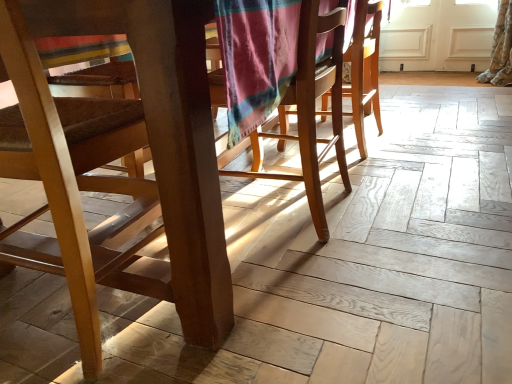
What do you see at coordinates (119, 157) in the screenshot?
I see `wooden chair at left, which is the 2th chair in right-to-left order` at bounding box center [119, 157].

Measure the distance between wooden chair at left, marked as the 1th chair in a left-to-right arrangement, and camera.

wooden chair at left, marked as the 1th chair in a left-to-right arrangement, is 22.46 inches away from camera.

What is the approximate width of wooden chair at left, which is the 2th chair in right-to-left order?

wooden chair at left, which is the 2th chair in right-to-left order, is 18.88 inches wide.

Where is `wooden chair at left, which is the 2th chair in right-to-left order`? wooden chair at left, which is the 2th chair in right-to-left order is located at coordinates (119, 157).

The image size is (512, 384). What are the coordinates of `wooden chair at center, the 2th chair in the left-to-right sequence` in the screenshot? It's located at (313, 108).

What do you see at coordinates (313, 108) in the screenshot? Image resolution: width=512 pixels, height=384 pixels. I see `wooden chair at center, the 2th chair in the left-to-right sequence` at bounding box center [313, 108].

In order to face wooden chair at center, which is the 1th chair from right to left, should I rotate leftwards or rightwards?

You should rotate right by 8.729 degrees.

Find the location of a particular element. The height and width of the screenshot is (384, 512). wooden chair at left, marked as the 1th chair in a left-to-right arrangement is located at coordinates (119, 157).

Can you confirm if wooden chair at center, which is the 1th chair from right to left, is positioned to the right of wooden chair at left, marked as the 1th chair in a left-to-right arrangement?

Yes, wooden chair at center, which is the 1th chair from right to left, is to the right of wooden chair at left, marked as the 1th chair in a left-to-right arrangement.

Is the position of wooden chair at center, which is the 1th chair from right to left, less distant than that of wooden chair at left, marked as the 1th chair in a left-to-right arrangement?

No, the depth of wooden chair at center, which is the 1th chair from right to left, is greater than that of wooden chair at left, marked as the 1th chair in a left-to-right arrangement.

Which is further, (307, 72) or (191, 246)?

Point (307, 72)

From the image's perspective, would you say wooden chair at center, which is the 1th chair from right to left, is shown under wooden chair at left, which is the 2th chair in right-to-left order?

No, from the image's perspective, wooden chair at center, which is the 1th chair from right to left, is not below wooden chair at left, which is the 2th chair in right-to-left order.

From a real-world perspective, which is physically above, wooden chair at center, the 2th chair in the left-to-right sequence, or wooden chair at left, marked as the 1th chair in a left-to-right arrangement?

wooden chair at left, marked as the 1th chair in a left-to-right arrangement, is physically above.

Which of these two, wooden chair at center, which is the 1th chair from right to left, or wooden chair at left, marked as the 1th chair in a left-to-right arrangement, is wider?

wooden chair at left, marked as the 1th chair in a left-to-right arrangement.

Considering the relative sizes of wooden chair at center, the 2th chair in the left-to-right sequence, and wooden chair at left, which is the 2th chair in right-to-left order, in the image provided, is wooden chair at center, the 2th chair in the left-to-right sequence, shorter than wooden chair at left, which is the 2th chair in right-to-left order,?

Yes, wooden chair at center, the 2th chair in the left-to-right sequence, is shorter than wooden chair at left, which is the 2th chair in right-to-left order.

In terms of size, does wooden chair at center, which is the 1th chair from right to left, appear bigger or smaller than wooden chair at left, which is the 2th chair in right-to-left order?

wooden chair at center, which is the 1th chair from right to left, is smaller than wooden chair at left, which is the 2th chair in right-to-left order.

Is wooden chair at center, which is the 1th chair from right to left, spatially inside wooden chair at left, marked as the 1th chair in a left-to-right arrangement, or outside of it?

wooden chair at center, which is the 1th chair from right to left, exists outside the volume of wooden chair at left, marked as the 1th chair in a left-to-right arrangement.

Is wooden chair at center, the 2th chair in the left-to-right sequence, far away from wooden chair at left, which is the 2th chair in right-to-left order?

That's not correct — wooden chair at center, the 2th chair in the left-to-right sequence, is a little close to wooden chair at left, which is the 2th chair in right-to-left order.

Is wooden chair at center, which is the 1th chair from right to left, oriented towards wooden chair at left, marked as the 1th chair in a left-to-right arrangement?

No, wooden chair at center, which is the 1th chair from right to left, is not aimed at wooden chair at left, marked as the 1th chair in a left-to-right arrangement.

Can you tell me how much wooden chair at center, the 2th chair in the left-to-right sequence, and wooden chair at left, which is the 2th chair in right-to-left order, differ in facing direction?

wooden chair at center, the 2th chair in the left-to-right sequence, and wooden chair at left, which is the 2th chair in right-to-left order, are facing 90 degrees away from each other.

In the image, there is a wooden chair at center, which is the 1th chair from right to left. What are the coordinates of `chair below it (from the image's perspective)` in the screenshot? It's located at point(119,157).

Can you confirm if wooden chair at left, marked as the 1th chair in a left-to-right arrangement, is positioned to the right of wooden chair at center, the 2th chair in the left-to-right sequence?

Incorrect, wooden chair at left, marked as the 1th chair in a left-to-right arrangement, is not on the right side of wooden chair at center, the 2th chair in the left-to-right sequence.

Between wooden chair at left, marked as the 1th chair in a left-to-right arrangement, and wooden chair at center, which is the 1th chair from right to left, which one is positioned in front?

wooden chair at left, marked as the 1th chair in a left-to-right arrangement, is closer to the camera.

Is point (36, 126) positioned after point (331, 20)?

No, it is not.

From the image's perspective, between wooden chair at left, marked as the 1th chair in a left-to-right arrangement, and wooden chair at center, which is the 1th chair from right to left, who is located below?

wooden chair at left, marked as the 1th chair in a left-to-right arrangement, from the image's perspective.

From a real-world perspective, who is located lower, wooden chair at left, marked as the 1th chair in a left-to-right arrangement, or wooden chair at center, the 2th chair in the left-to-right sequence?

From a 3D spatial view, wooden chair at center, the 2th chair in the left-to-right sequence, is below.

Based on the photo, in terms of width, does wooden chair at left, marked as the 1th chair in a left-to-right arrangement, look wider or thinner when compared to wooden chair at center, which is the 1th chair from right to left?

wooden chair at left, marked as the 1th chair in a left-to-right arrangement, is wider than wooden chair at center, which is the 1th chair from right to left.

Which of these two, wooden chair at left, marked as the 1th chair in a left-to-right arrangement, or wooden chair at center, the 2th chair in the left-to-right sequence, stands shorter?

Standing shorter between the two is wooden chair at center, the 2th chair in the left-to-right sequence.

Considering the relative sizes of wooden chair at left, marked as the 1th chair in a left-to-right arrangement, and wooden chair at center, which is the 1th chair from right to left, in the image provided, is wooden chair at left, marked as the 1th chair in a left-to-right arrangement, bigger than wooden chair at center, which is the 1th chair from right to left,?

Yes, wooden chair at left, marked as the 1th chair in a left-to-right arrangement, is bigger than wooden chair at center, which is the 1th chair from right to left.

Is wooden chair at left, marked as the 1th chair in a left-to-right arrangement, situated inside wooden chair at center, which is the 1th chair from right to left, or outside?

wooden chair at left, marked as the 1th chair in a left-to-right arrangement, is not inside wooden chair at center, which is the 1th chair from right to left, it's outside.

Is wooden chair at left, which is the 2th chair in right-to-left order, far from wooden chair at center, the 2th chair in the left-to-right sequence?

Actually, wooden chair at left, which is the 2th chair in right-to-left order, and wooden chair at center, the 2th chair in the left-to-right sequence, are a little close together.

Is wooden chair at left, which is the 2th chair in right-to-left order, facing towards wooden chair at center, the 2th chair in the left-to-right sequence?

No, wooden chair at left, which is the 2th chair in right-to-left order, does not turn towards wooden chair at center, the 2th chair in the left-to-right sequence.

What's the angular difference between wooden chair at left, which is the 2th chair in right-to-left order, and wooden chair at center, the 2th chair in the left-to-right sequence,'s facing directions?

wooden chair at left, which is the 2th chair in right-to-left order, and wooden chair at center, the 2th chair in the left-to-right sequence, are facing 90 degrees away from each other.

Find the location of a particular element. The width and height of the screenshot is (512, 384). chair located above the wooden chair at center, the 2th chair in the left-to-right sequence (from a real-world perspective) is located at coordinates (119, 157).

Locate an element on the screen. The width and height of the screenshot is (512, 384). chair above the wooden chair at center, the 2th chair in the left-to-right sequence (from a real-world perspective) is located at coordinates (119, 157).

Where is `chair to the right of wooden chair at left, which is the 2th chair in right-to-left order`? This screenshot has width=512, height=384. chair to the right of wooden chair at left, which is the 2th chair in right-to-left order is located at coordinates (313, 108).